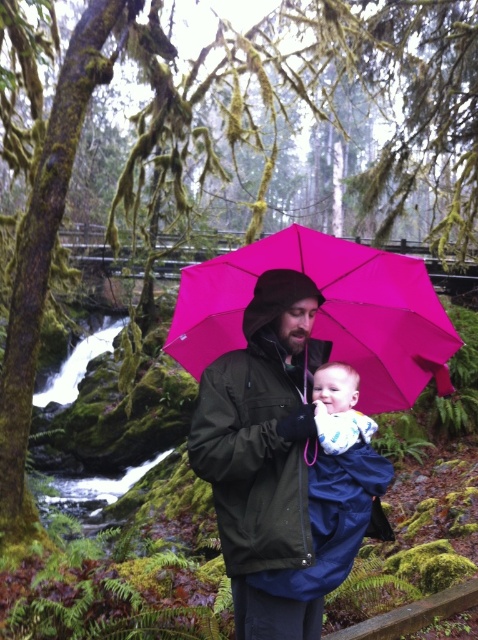
In the rainy forest scene, there is a man wearing a matte black jacket at center and a baby in a blue cotton onesie at center. If you were to place both items on a flat surface, which one would occupy more space?

The matte black jacket at center is larger in size than the blue cotton onesie at center, so it would occupy more space on the flat surface.